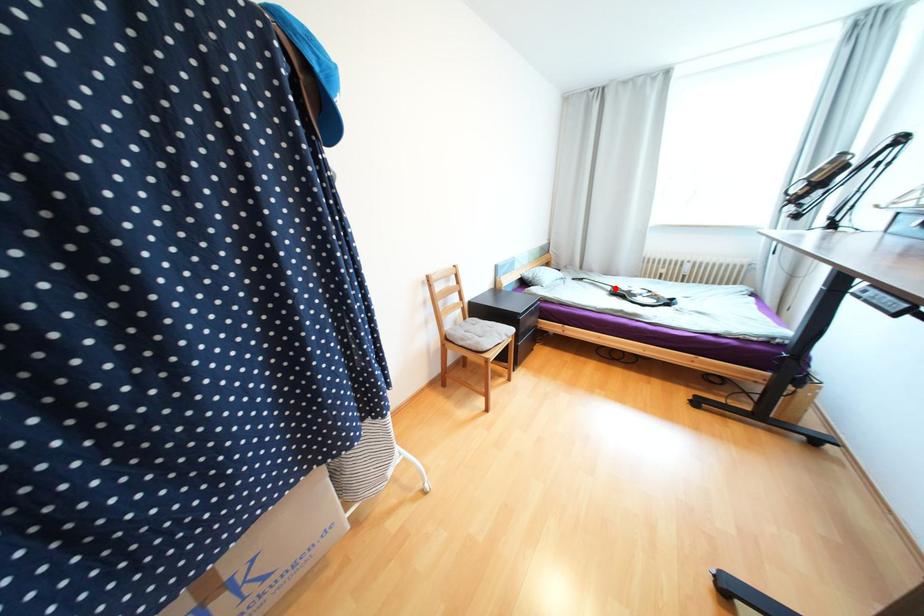
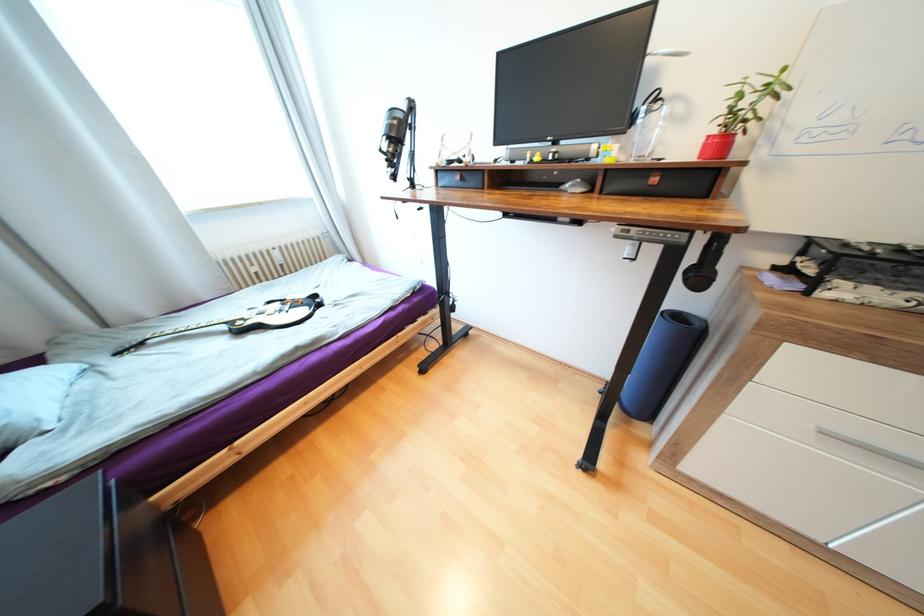
In the second image, find the point that corresponds to the highlighted location in the first image.

(229, 328)